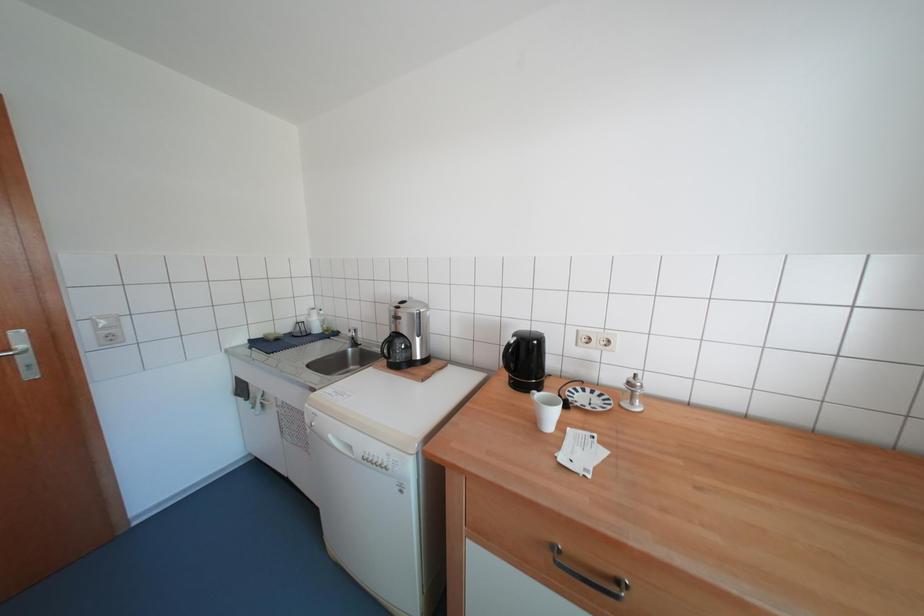
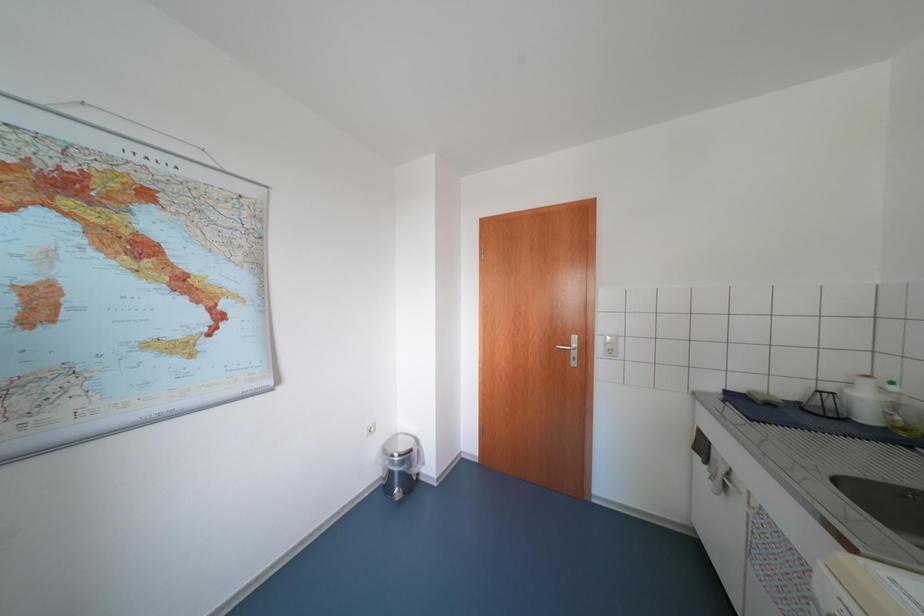
Question: The camera is either moving clockwise (left) or counter-clockwise (right) around the object. The first image is from the beginning of the video and the second image is from the end. Is the camera moving left or right when shooting the video?

Choices:
 (A) Left
 (B) Right

Answer: (B)